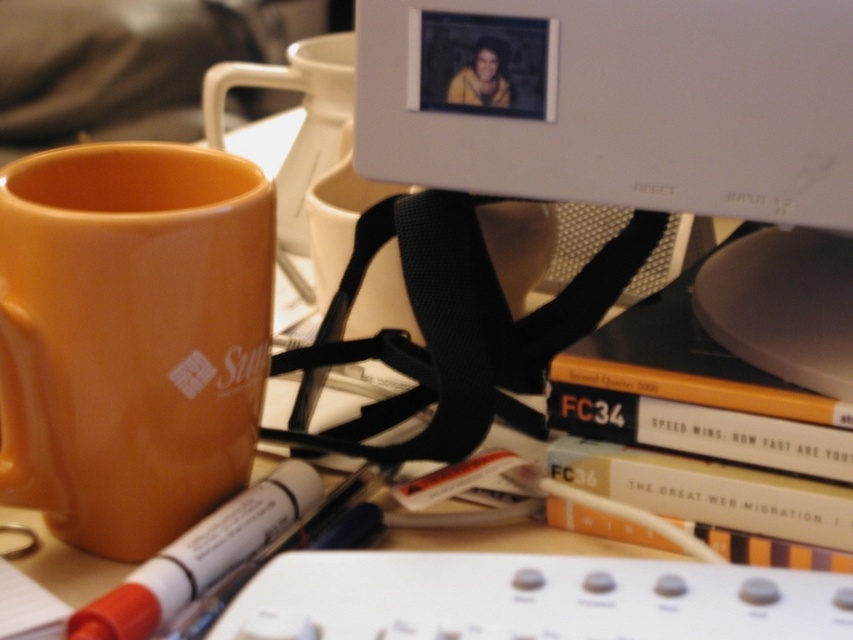
You have a small container that needs to be placed on the desk. The container is exactly the same width as the white matte marker at lower left. Can the container fit horizontally next to the matte orange mug at left without overlapping?

The matte orange mug at left might be wider than white matte marker at lower left, so there is a possibility that the container will not fit next to it. Check the actual width of the mug before placing the container.

You need to place a new object between the hardcover book at center and the white matte marker at lower left. Considering their sizes, which object should be placed closer to the larger one?

The hardcover book at center is larger in width than the white matte marker at lower left. Therefore, the new object should be placed closer to the hardcover book at center since it has a larger size.

You are organizing the desk and need to retrieve the white matte marker at lower left. Can you access it without moving the hardcover book at center?

The white matte marker at lower left is behind the hardcover book at center, so you cannot access it without moving the hardcover book at center.